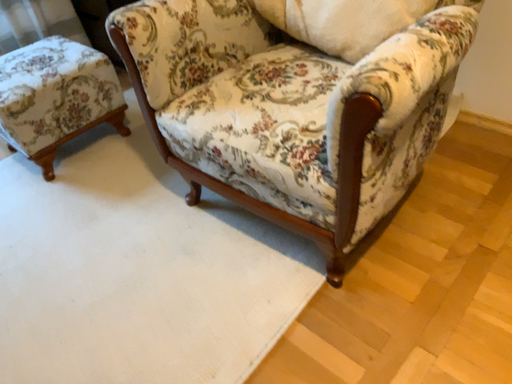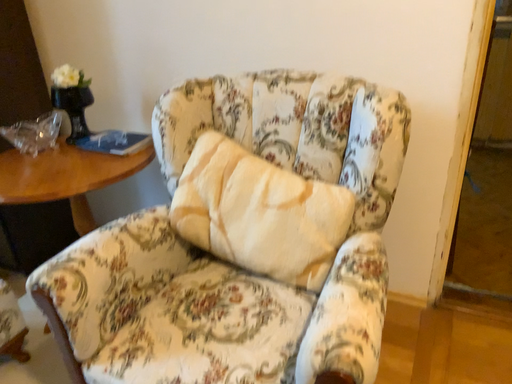
Question: How did the camera likely rotate when shooting the video?

Choices:
 (A) rotated upward
 (B) rotated downward

Answer: (A)